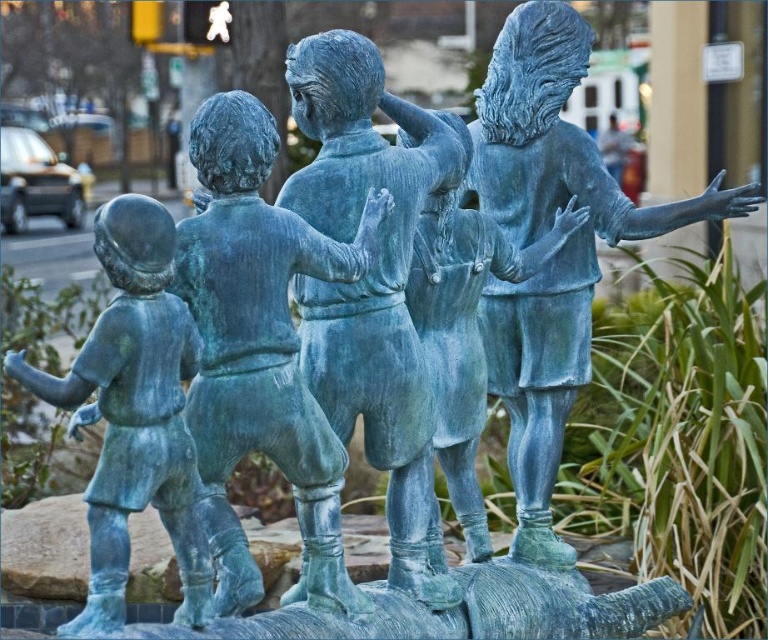
Question: Can you confirm if green patina bronze statue at center is positioned to the right of green patina statue at left?

Choices:
 (A) yes
 (B) no

Answer: (A)

Question: Is green patina bronze statue at center bigger than green patina statue at left?

Choices:
 (A) no
 (B) yes

Answer: (B)

Question: Which of the following is the farthest from the observer?

Choices:
 (A) green patina bronze statue at center
 (B) green patina statue at center

Answer: (A)

Question: Which point is farther from the camera taking this photo?

Choices:
 (A) pyautogui.click(x=293, y=445)
 (B) pyautogui.click(x=359, y=317)

Answer: (B)

Question: Observing the image, what is the correct spatial positioning of green patina statue at center in reference to green patina bronze statue at center?

Choices:
 (A) below
 (B) above

Answer: (A)

Question: Among these objects, which one is farthest from the camera?

Choices:
 (A) green patina statue at left
 (B) green patina bronze statue at center

Answer: (B)